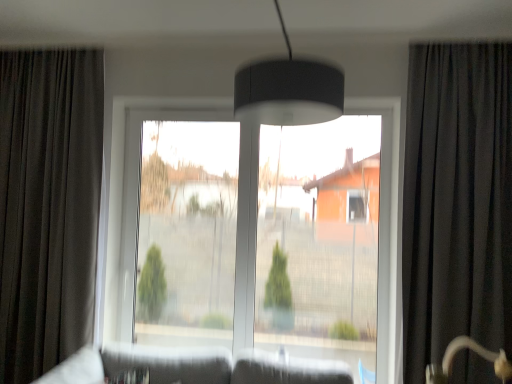
Find the location of `dark grey fabric curtain at left, acting as the first curtain starting from the left`. dark grey fabric curtain at left, acting as the first curtain starting from the left is located at coordinates (48, 206).

Locate an element on the screen. transparent glass window screen at center is located at coordinates (187, 233).

What are the coordinates of `black velvet curtain at right, which is the 1th curtain from right to left` in the screenshot? It's located at 457,201.

Where is `transparent glass window at center`? The height and width of the screenshot is (384, 512). transparent glass window at center is located at coordinates (134, 191).

Could you tell me if dark grey fabric curtain at left, acting as the first curtain starting from the left, is turned towards transparent glass window at center?

No, dark grey fabric curtain at left, acting as the first curtain starting from the left, is not turned towards transparent glass window at center.

The image size is (512, 384). Identify the location of curtain that is the 1st one when counting upward from the transparent glass window at center (from the image's perspective). (48, 206).

Which is more distant, (31, 68) or (214, 112)?

The point (214, 112) is more distant.

Considering the sizes of dark grey fabric curtain at left, acting as the first curtain starting from the left, and transparent glass window at center in the image, is dark grey fabric curtain at left, acting as the first curtain starting from the left, taller or shorter than transparent glass window at center?

dark grey fabric curtain at left, acting as the first curtain starting from the left, is taller than transparent glass window at center.

Is dark grey fabric curtain at left, acting as the first curtain starting from the left, positioned beyond the bounds of black velvet curtain at right, marked as the second curtain in a left-to-right arrangement?

Yes, dark grey fabric curtain at left, acting as the first curtain starting from the left, is not within black velvet curtain at right, marked as the second curtain in a left-to-right arrangement.

From a real-world perspective, is dark grey fabric curtain at left, acting as the first curtain starting from the left, above or below black velvet curtain at right, which is the 1th curtain from right to left?

Clearly, from a real-world perspective, dark grey fabric curtain at left, acting as the first curtain starting from the left, is below black velvet curtain at right, which is the 1th curtain from right to left.

How far apart are dark grey fabric curtain at left, the 2th curtain from the right, and black velvet curtain at right, marked as the second curtain in a left-to-right arrangement?

dark grey fabric curtain at left, the 2th curtain from the right, is 2.18 meters from black velvet curtain at right, marked as the second curtain in a left-to-right arrangement.

Is dark grey fabric curtain at left, acting as the first curtain starting from the left, aimed at black velvet curtain at right, marked as the second curtain in a left-to-right arrangement?

No, dark grey fabric curtain at left, acting as the first curtain starting from the left, is not aimed at black velvet curtain at right, marked as the second curtain in a left-to-right arrangement.

Considering the sizes of objects black velvet curtain at right, marked as the second curtain in a left-to-right arrangement, and dark grey fabric curtain at left, the 2th curtain from the right, in the image provided, who is bigger, black velvet curtain at right, marked as the second curtain in a left-to-right arrangement, or dark grey fabric curtain at left, the 2th curtain from the right,?

black velvet curtain at right, marked as the second curtain in a left-to-right arrangement.

From a real-world perspective, who is located higher, black velvet curtain at right, which is the 1th curtain from right to left, or dark grey fabric curtain at left, acting as the first curtain starting from the left?

From a 3D spatial view, black velvet curtain at right, which is the 1th curtain from right to left, is above.

Considering the relative sizes of black velvet curtain at right, marked as the second curtain in a left-to-right arrangement, and dark grey fabric curtain at left, the 2th curtain from the right, in the image provided, is black velvet curtain at right, marked as the second curtain in a left-to-right arrangement, wider than dark grey fabric curtain at left, the 2th curtain from the right,?

Yes, black velvet curtain at right, marked as the second curtain in a left-to-right arrangement, is wider than dark grey fabric curtain at left, the 2th curtain from the right.

From the image's perspective, which one is positioned lower, transparent glass window at center or dark grey fabric curtain at left, acting as the first curtain starting from the left?

transparent glass window at center is shown below in the image.

Which of these two, transparent glass window at center or dark grey fabric curtain at left, the 2th curtain from the right, is thinner?

transparent glass window at center.

Where is `window that is on the right side of dark grey fabric curtain at left, acting as the first curtain starting from the left`? The height and width of the screenshot is (384, 512). window that is on the right side of dark grey fabric curtain at left, acting as the first curtain starting from the left is located at coordinates (134, 191).

From a real-world perspective, is transparent glass window at center over dark grey fabric curtain at left, acting as the first curtain starting from the left?

Actually, transparent glass window at center is physically below dark grey fabric curtain at left, acting as the first curtain starting from the left, in the real world.

Considering the points (499, 51) and (231, 297), which point is in front, point (499, 51) or point (231, 297)?

The point (499, 51) is more forward.

Considering the relative sizes of black velvet curtain at right, which is the 1th curtain from right to left, and transparent glass window screen at center in the image provided, is black velvet curtain at right, which is the 1th curtain from right to left, wider than transparent glass window screen at center?

Indeed, black velvet curtain at right, which is the 1th curtain from right to left, has a greater width compared to transparent glass window screen at center.

Is black velvet curtain at right, which is the 1th curtain from right to left, aimed at transparent glass window screen at center?

No, black velvet curtain at right, which is the 1th curtain from right to left, is not oriented towards transparent glass window screen at center.

Considering the sizes of objects transparent glass window screen at center and black velvet curtain at right, marked as the second curtain in a left-to-right arrangement, in the image provided, who is wider, transparent glass window screen at center or black velvet curtain at right, marked as the second curtain in a left-to-right arrangement,?

Wider between the two is black velvet curtain at right, marked as the second curtain in a left-to-right arrangement.

At what (x,y) coordinates should I click in order to perform the action: click on the 2nd curtain in front of the transparent glass window screen at center, starting your count from the anchor. Please return your answer as a coordinate pair (x, y). Looking at the image, I should click on (457, 201).

Considering the relative positions of transparent glass window screen at center and black velvet curtain at right, marked as the second curtain in a left-to-right arrangement, in the image provided, is transparent glass window screen at center to the right of black velvet curtain at right, marked as the second curtain in a left-to-right arrangement, from the viewer's perspective?

In fact, transparent glass window screen at center is to the left of black velvet curtain at right, marked as the second curtain in a left-to-right arrangement.

Do you think transparent glass window screen at center is within black velvet curtain at right, which is the 1th curtain from right to left, or outside of it?

transparent glass window screen at center is spatially situated outside black velvet curtain at right, which is the 1th curtain from right to left.

From the picture: Which of these two, transparent glass window screen at center or dark grey fabric curtain at left, acting as the first curtain starting from the left, stands taller?

dark grey fabric curtain at left, acting as the first curtain starting from the left.

Is the position of transparent glass window screen at center less distant than that of dark grey fabric curtain at left, acting as the first curtain starting from the left?

No, the depth of transparent glass window screen at center is greater than that of dark grey fabric curtain at left, acting as the first curtain starting from the left.

Considering the positions of point (146, 310) and point (37, 285), is point (146, 310) closer or farther from the camera than point (37, 285)?

Point (146, 310) appears to be farther away from the viewer than point (37, 285).

Is transparent glass window screen at center far away from dark grey fabric curtain at left, acting as the first curtain starting from the left?

Indeed, transparent glass window screen at center is not near dark grey fabric curtain at left, acting as the first curtain starting from the left.

The height and width of the screenshot is (384, 512). Identify the location of the 1st curtain positioned above the transparent glass window at center (from a real-world perspective). [48, 206].

In order to click on curtain below the black velvet curtain at right, marked as the second curtain in a left-to-right arrangement (from a real-world perspective) in this screenshot , I will do `click(48, 206)`.

When comparing their distances from transparent glass window at center, does dark grey fabric curtain at left, the 2th curtain from the right, or black velvet curtain at right, which is the 1th curtain from right to left, seem further?

Among the two, black velvet curtain at right, which is the 1th curtain from right to left, is located further to transparent glass window at center.

Which object lies nearer to the anchor point black velvet curtain at right, marked as the second curtain in a left-to-right arrangement, transparent glass window screen at center or transparent glass window at center?

Among the two, transparent glass window at center is located nearer to black velvet curtain at right, marked as the second curtain in a left-to-right arrangement.

In the scene shown: Looking at the image, which one is located further to dark grey fabric curtain at left, acting as the first curtain starting from the left, transparent glass window screen at center or transparent glass window at center?

transparent glass window screen at center is further to dark grey fabric curtain at left, acting as the first curtain starting from the left.

From the image, which object appears to be nearer to transparent glass window screen at center, black velvet curtain at right, marked as the second curtain in a left-to-right arrangement, or transparent glass window at center?

transparent glass window at center.

Looking at the image, which one is located closer to dark grey fabric curtain at left, the 2th curtain from the right, black velvet curtain at right, marked as the second curtain in a left-to-right arrangement, or transparent glass window at center?

The object closer to dark grey fabric curtain at left, the 2th curtain from the right, is transparent glass window at center.

From the image, which object appears to be farther from black velvet curtain at right, marked as the second curtain in a left-to-right arrangement, transparent glass window at center or dark grey fabric curtain at left, the 2th curtain from the right?

Among the two, dark grey fabric curtain at left, the 2th curtain from the right, is located further to black velvet curtain at right, marked as the second curtain in a left-to-right arrangement.

From the image, which object appears to be farther from transparent glass window screen at center, transparent glass window at center or black velvet curtain at right, marked as the second curtain in a left-to-right arrangement?

black velvet curtain at right, marked as the second curtain in a left-to-right arrangement, is positioned further to the anchor transparent glass window screen at center.

Estimate the real-world distances between objects in this image. Which object is closer to black velvet curtain at right, which is the 1th curtain from right to left, transparent glass window at center or transparent glass window screen at center?

transparent glass window at center lies closer to black velvet curtain at right, which is the 1th curtain from right to left, than the other object.

This screenshot has height=384, width=512. In order to click on window between dark grey fabric curtain at left, the 2th curtain from the right, and black velvet curtain at right, marked as the second curtain in a left-to-right arrangement, in the horizontal direction in this screenshot , I will do `click(134, 191)`.

You are a GUI agent. You are given a task and a screenshot of the screen. Output one action in this format:
    pyautogui.click(x=<x>, y=<y>)
    Task: Click on the window between transparent glass window screen at center and black velvet curtain at right, marked as the second curtain in a left-to-right arrangement, in the horizontal direction
    This screenshot has height=384, width=512.
    Given the screenshot: What is the action you would take?
    pyautogui.click(x=134, y=191)

Identify the location of window screen between dark grey fabric curtain at left, the 2th curtain from the right, and black velvet curtain at right, marked as the second curtain in a left-to-right arrangement, from left to right. (187, 233).

Find the location of `window screen between dark grey fabric curtain at left, acting as the first curtain starting from the left, and transparent glass window at center`. window screen between dark grey fabric curtain at left, acting as the first curtain starting from the left, and transparent glass window at center is located at coordinates (187, 233).